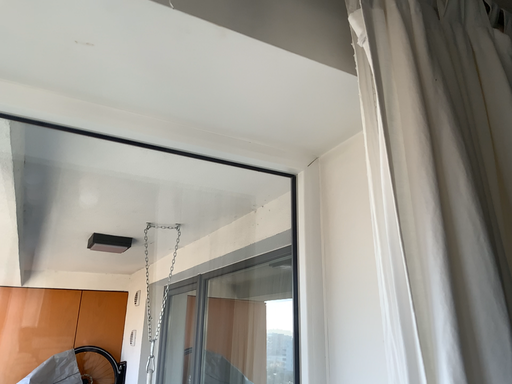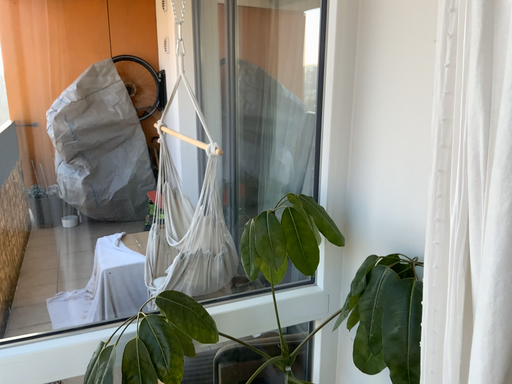
Question: Which way did the camera rotate in the video?

Choices:
 (A) rotated downward
 (B) rotated upward

Answer: (A)